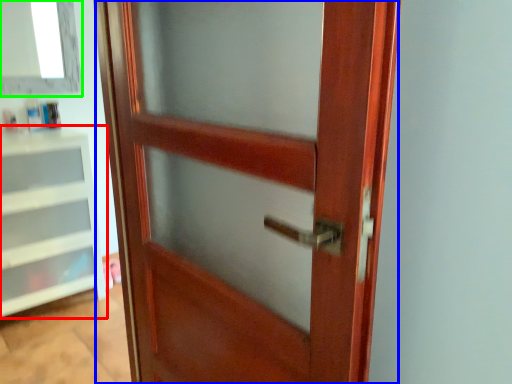
Question: Which is nearer to the shelf (highlighted by a red box)? door (highlighted by a blue box) or window (highlighted by a green box).

Choices:
 (A) door
 (B) window

Answer: (B)